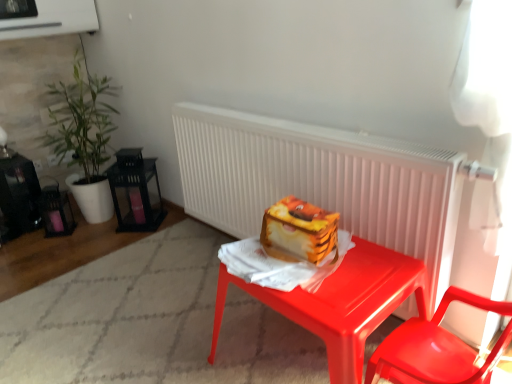
Locate an element on the screen. The image size is (512, 384). vacant area on top of glossy plastic desk at center (from a real-world perspective) is located at coordinates (329, 276).